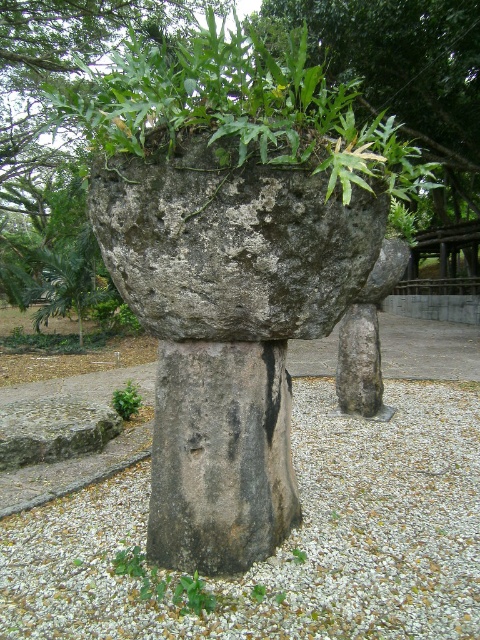
You are standing in a garden and want to water the gray stone statue at center. If your watering can has a maximum reach of 4 meters, can you reach the statue without moving closer?

The gray stone statue at center is 4.83 meters away from the viewer, which is beyond the watering can reach of 4 meters. You need to move closer to reach it.

You are a gardener who wants to plant a new shrub. You see the gray rough stone at center and the gray stone statue at center. Which object should you place the shrub near to ensure it gets enough sunlight?

The gray rough stone at center is above the gray stone statue at center, so placing the shrub near the gray rough stone at center would provide better sunlight access since it is higher up.

You are a gardener who needs to move a 3.5 meter long hose from the gray gravel at center to the green rough stone at upper center. Can you lay the hose directly between them without bending it?

The distance between the gray gravel at center and the green rough stone at upper center is 4.39 meters. Since the hose is only 3.5 meters long, it is not long enough to reach without bending.